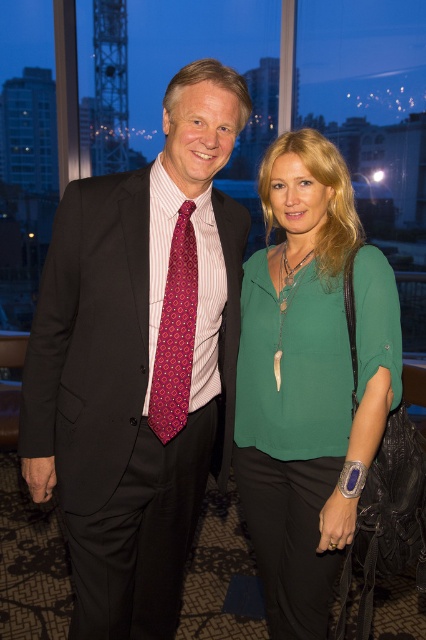
You are a photographer at an event and need to ensure that both the matte black suit at center and the dark pink textured tie at center are visible in the photo. Given their sizes, which object should you focus on to capture both in frame?

The matte black suit at center is much taller than the dark pink textured tie at center, so focusing on the taller matte black suit at center will ensure both are visible in the frame.

You are a photographer at the event and want to capture a clear shot of both the green silk blouse at center and the dark pink textured tie at center. However, you notice that one is blocking the other. Which object is in front and might be obscuring the other?

The green silk blouse at center is in front of the dark pink textured tie at center, so it might be obscuring the tie.